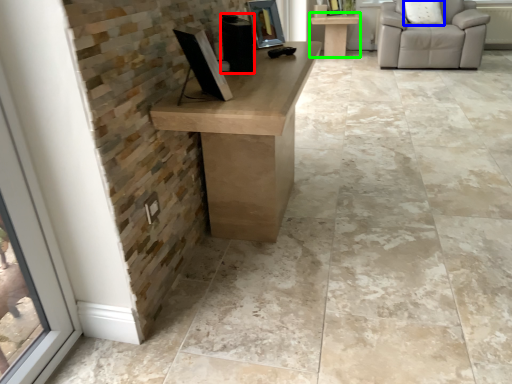
Question: Which is nearer to the speaker (highlighted by a red box)? pillow (highlighted by a blue box) or table (highlighted by a green box).

Choices:
 (A) pillow
 (B) table

Answer: (A)